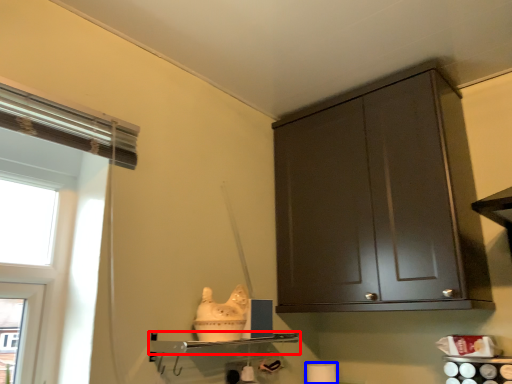
Question: Among these objects, which one is farthest to the camera, shelf (highlighted by a red box) or toilet paper (highlighted by a blue box)?

Choices:
 (A) shelf
 (B) toilet paper

Answer: (B)